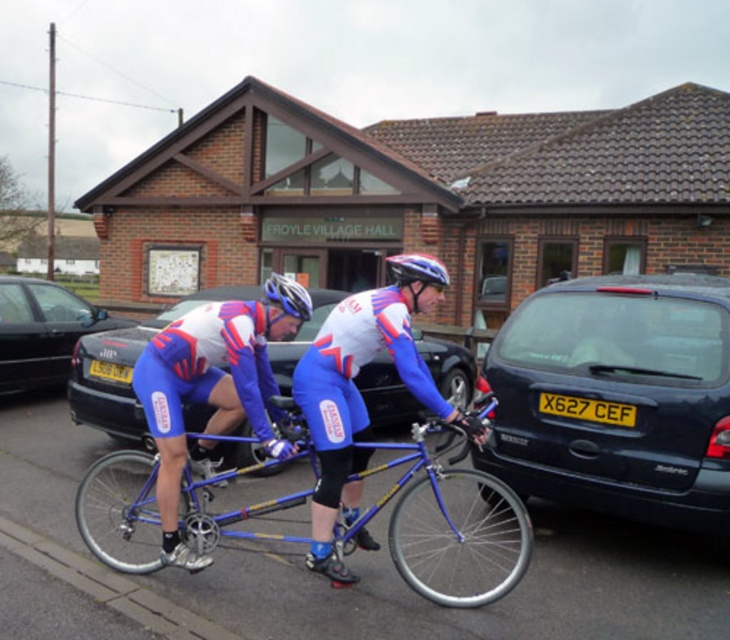
Can you confirm if dark blue metallic car at right is thinner than blue fabric cycling suit at center?

No, dark blue metallic car at right is not thinner than blue fabric cycling suit at center.

Does dark blue metallic car at right have a lesser height compared to blue fabric cycling suit at center?

No, dark blue metallic car at right is not shorter than blue fabric cycling suit at center.

Between point (577, 280) and point (358, 419), which one is positioned behind?

Point (577, 280)

At what (x,y) coordinates should I click in order to perform the action: click on dark blue metallic car at right. Please return your answer as a coordinate pair (x, y). Image resolution: width=730 pixels, height=640 pixels. Looking at the image, I should click on (618, 397).

Is white matte bicycle helmet at center shorter than yellow matte license plate at center?

Incorrect, white matte bicycle helmet at center's height does not fall short of yellow matte license plate at center's.

Who is more forward, (410, 280) or (118, 376)?

Point (410, 280) is more forward.

Image resolution: width=730 pixels, height=640 pixels. Find the location of `white matte bicycle helmet at center`. white matte bicycle helmet at center is located at coordinates (415, 269).

Does metallic blue bicycle at center appear under yellowmaterial/texturelicense plate at center?

Actually, metallic blue bicycle at center is above yellowmaterial/texturelicense plate at center.

Does metallic blue bicycle at center have a lesser width compared to yellowmaterial/texturelicense plate at center?

In fact, metallic blue bicycle at center might be wider than yellowmaterial/texturelicense plate at center.

Is point (82, 352) more distant than point (595, 400)?

Yes, it is behind point (595, 400).

The width and height of the screenshot is (730, 640). I want to click on metallic blue bicycle at center, so click(128, 365).